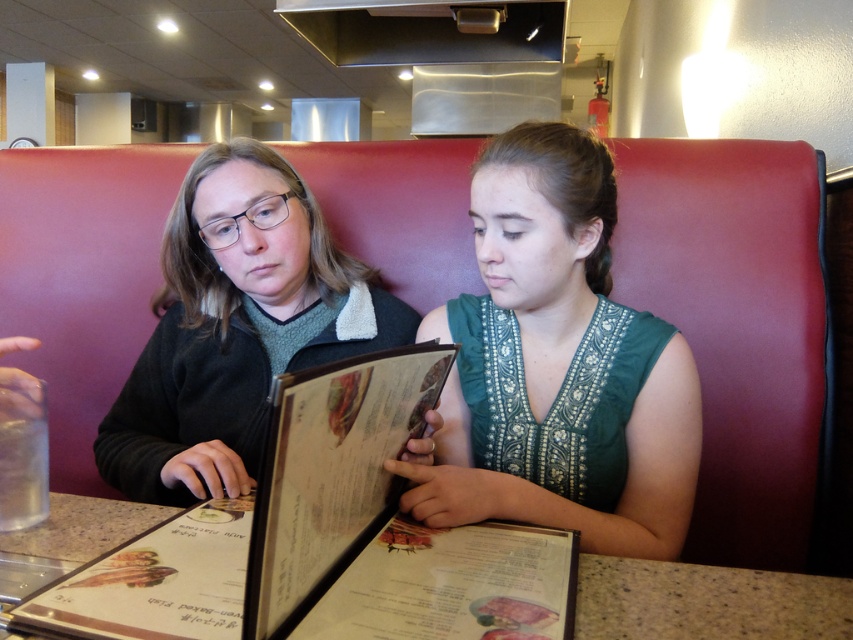
Does matte black sweater at left have a larger size compared to black matte menu at center?

Yes.

Between matte black sweater at left and black matte menu at center, which one is positioned higher?

Positioned higher is matte black sweater at left.

The height and width of the screenshot is (640, 853). What are the coordinates of `matte black sweater at left` in the screenshot? It's located at (236, 326).

Consider the image. Who is lower down, green fabric dress at center or wooden table at center?

wooden table at center

Which of these two, green fabric dress at center or wooden table at center, stands shorter?

wooden table at center is shorter.

Which is behind, point (463, 420) or point (627, 618)?

The point (463, 420) is behind.

Where is `green fabric dress at center`? Image resolution: width=853 pixels, height=640 pixels. green fabric dress at center is located at coordinates (558, 365).

Can you confirm if green fabric dress at center is positioned to the right of black matte menu at center?

Indeed, green fabric dress at center is positioned on the right side of black matte menu at center.

Does green fabric dress at center come in front of black matte menu at center?

No.

Is point (689, 458) positioned behind point (326, 440)?

Yes, point (689, 458) is farther from viewer.

Find the location of a particular element. green fabric dress at center is located at coordinates (558, 365).